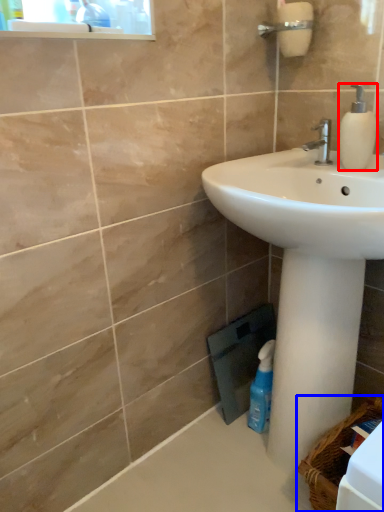
Question: Among these objects, which one is nearest to the camera, soap dispenser (highlighted by a red box) or basket (highlighted by a blue box)?

Choices:
 (A) soap dispenser
 (B) basket

Answer: (B)